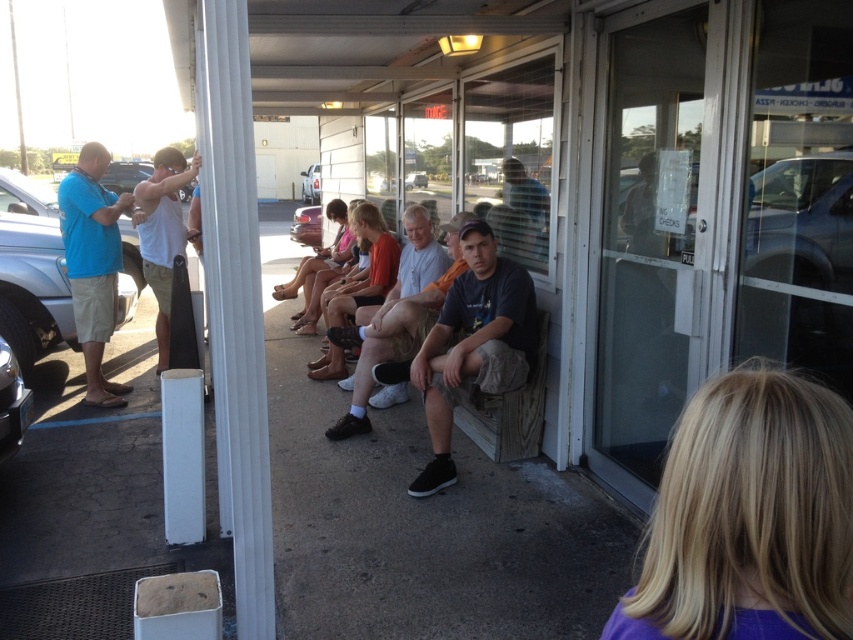
Please provide the 2D coordinates of the white matte tank top at left in the image. The coordinates should be in the format of a point with two decimal places, like point 0.364, 0.191. The scene is a group of people outside a building with long shadows, under a sheltered entrance with glass doors and windows. The person wearing the tank top is sitting on a wooden bench among others in casual attire.

The white matte tank top at left is located at point [161,232].